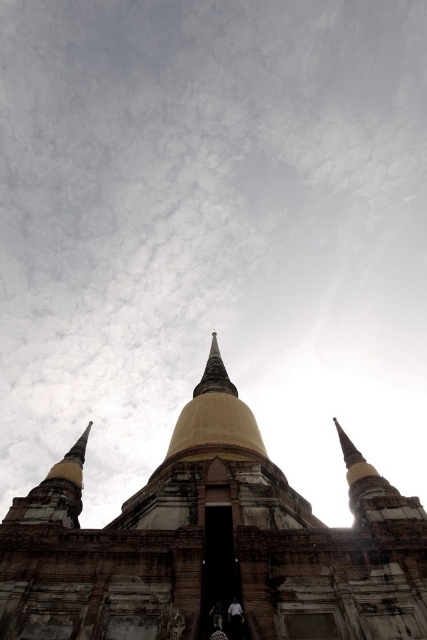
Question: Can you confirm if gold/golden stone temple at center is positioned to the left of gold/golden stupa at center?

Choices:
 (A) no
 (B) yes

Answer: (A)

Question: Among these objects, which one is nearest to the camera?

Choices:
 (A) gold/golden stone temple at center
 (B) gold/golden stupa at center

Answer: (A)

Question: Does gold/golden stone temple at center appear on the left side of gold/golden stupa at center?

Choices:
 (A) no
 (B) yes

Answer: (A)

Question: Does gold/golden stone temple at center come behind gold/golden stupa at center?

Choices:
 (A) no
 (B) yes

Answer: (A)

Question: Which of the following is the closest to the observer?

Choices:
 (A) (271, 545)
 (B) (215, 371)

Answer: (A)